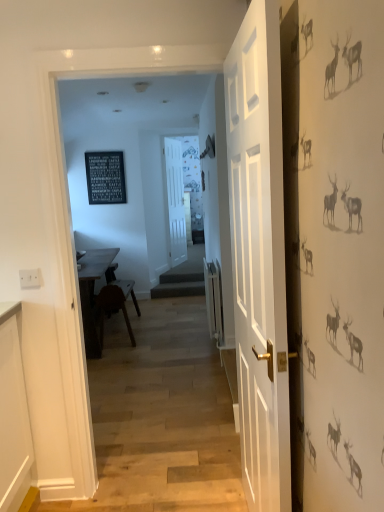
Question: Can you confirm if white wooden door at center, the 2th door when ordered from back to front, is thinner than black slate sign at upper center?

Choices:
 (A) no
 (B) yes

Answer: (A)

Question: Does white wooden door at center, the first door from the right, have a larger size compared to black slate sign at upper center?

Choices:
 (A) yes
 (B) no

Answer: (A)

Question: From the image's perspective, is white wooden door at center, arranged as the second door when viewed from the left, on top of black slate sign at upper center?

Choices:
 (A) yes
 (B) no

Answer: (B)

Question: Considering the relative positions of white wooden door at center, arranged as the second door when viewed from the left, and black slate sign at upper center in the image provided, is white wooden door at center, arranged as the second door when viewed from the left, to the left of black slate sign at upper center from the viewer's perspective?

Choices:
 (A) yes
 (B) no

Answer: (B)

Question: Can you confirm if white wooden door at center, the 2th door when ordered from back to front, is shorter than black slate sign at upper center?

Choices:
 (A) yes
 (B) no

Answer: (B)

Question: From a real-world perspective, is black slate sign at upper center positioned above or below white wooden door at center, arranged as the second door when viewed from the left?

Choices:
 (A) above
 (B) below

Answer: (A)

Question: Looking at their shapes, would you say black slate sign at upper center is wider or thinner than white wooden door at center, the 2th door when ordered from back to front?

Choices:
 (A) thin
 (B) wide

Answer: (A)

Question: Is black slate sign at upper center spatially inside white wooden door at center, the first door from the right, or outside of it?

Choices:
 (A) outside
 (B) inside

Answer: (A)

Question: From the image's perspective, is black slate sign at upper center located above or below white wooden door at center, which is the first door from front to back?

Choices:
 (A) above
 (B) below

Answer: (A)

Question: From the image's perspective, is black slate sign at upper center above or below white matte door at center, the 1th door in the back-to-front sequence?

Choices:
 (A) below
 (B) above

Answer: (B)

Question: In terms of size, does black slate sign at upper center appear bigger or smaller than white matte door at center, the 1th door in the back-to-front sequence?

Choices:
 (A) small
 (B) big

Answer: (A)

Question: In the image, is black slate sign at upper center positioned in front of or behind white matte door at center, arranged as the 2th door when viewed from the front?

Choices:
 (A) front
 (B) behind

Answer: (A)

Question: Is black slate sign at upper center situated inside white matte door at center, the 2th door viewed from the right, or outside?

Choices:
 (A) outside
 (B) inside

Answer: (A)

Question: Would you say white matte door at center, the first door positioned from the left, is inside or outside wooden table at center?

Choices:
 (A) inside
 (B) outside

Answer: (B)

Question: Relative to wooden table at center, is white matte door at center, the 2th door viewed from the right, in front or behind?

Choices:
 (A) behind
 (B) front

Answer: (A)